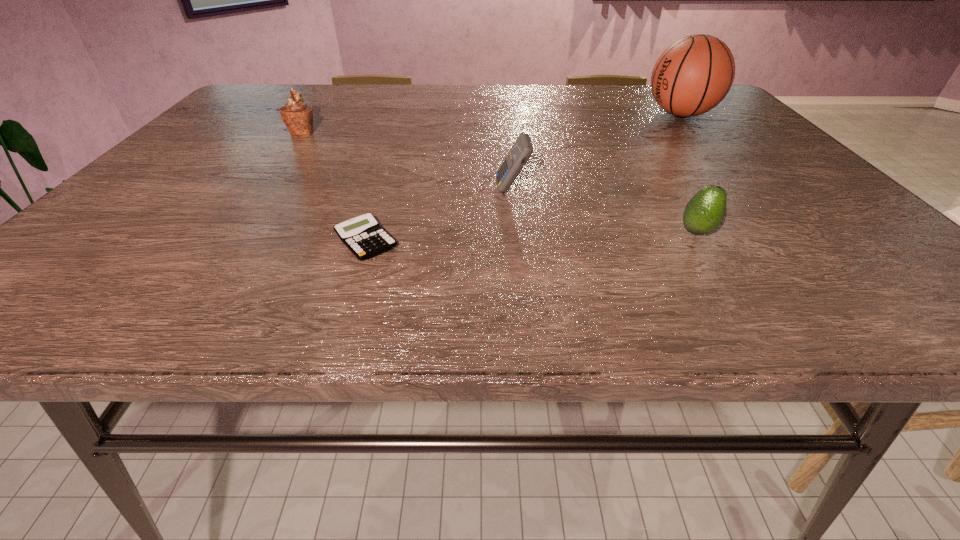
Find the location of a particular element. The height and width of the screenshot is (540, 960). vacant space that satisfies the following two spatial constraints: 1. on the back side of the second shortest object; 2. on the front-facing side of the third nearest object is located at coordinates (669, 190).

Image resolution: width=960 pixels, height=540 pixels. Identify the location of vacant space that satisfies the following two spatial constraints: 1. on the front-facing side of the third farthest object; 2. on the front side of the nearer calculator. (517, 241).

Image resolution: width=960 pixels, height=540 pixels. Identify the location of vacant area in the image that satisfies the following two spatial constraints: 1. on the front-facing side of the farther calculator; 2. on the front side of the left calculator. (517, 241).

Identify the location of blank area in the image that satisfies the following two spatial constraints: 1. on the front-facing side of the second object from right to left; 2. on the right side of the third farthest object. (516, 232).